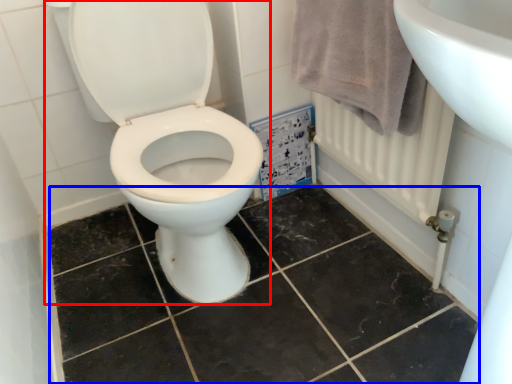
Question: Which point is further to the camera, toilet (highlighted by a red box) or ceramic tile (highlighted by a blue box)?

Choices:
 (A) toilet
 (B) ceramic tile

Answer: (B)